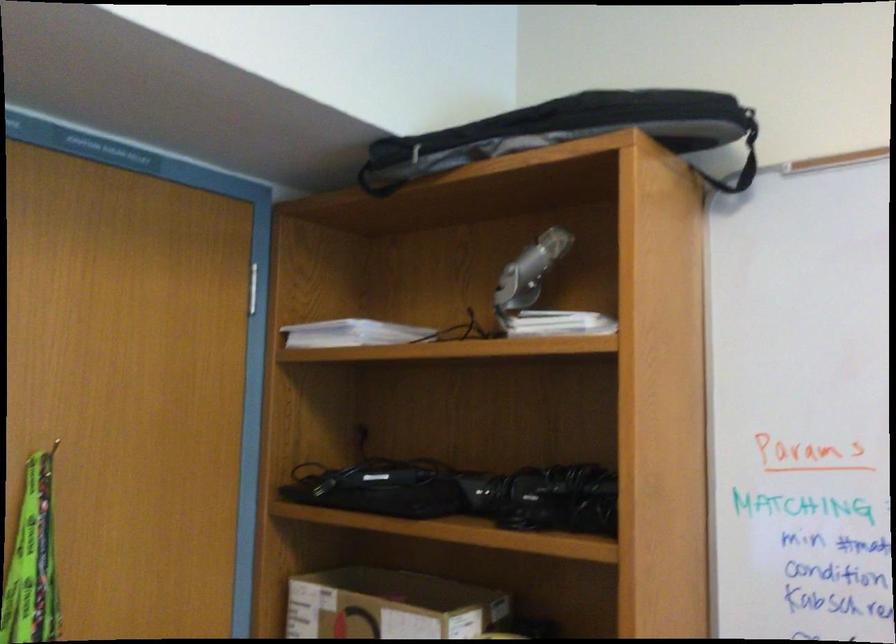
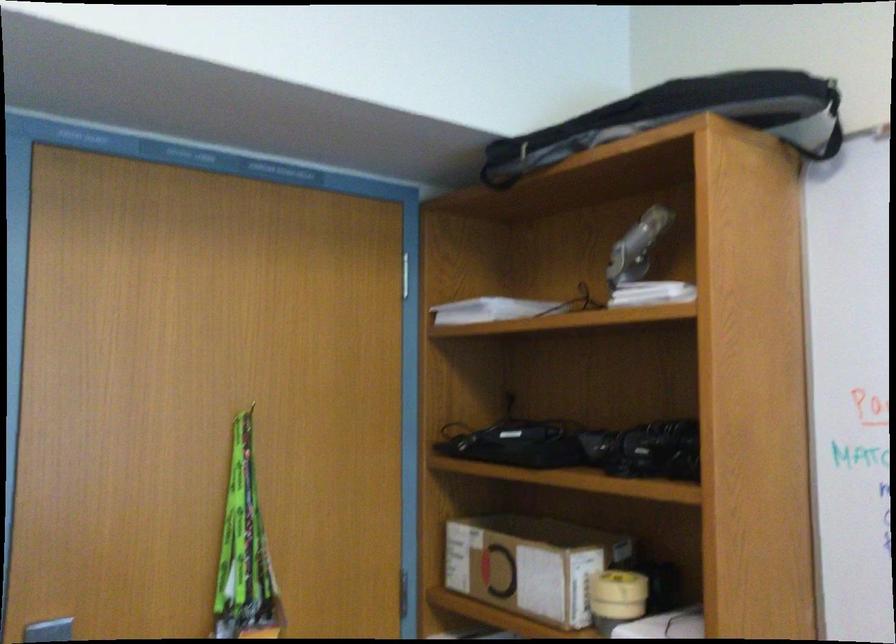
The point at (737,160) is marked in the first image. Where is the corresponding point in the second image?

(829, 129)